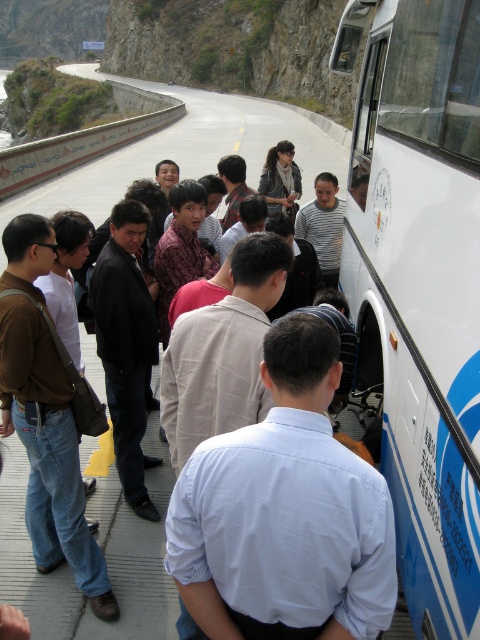
From the picture: Based on the scene description, where is the white matte bus at right located in terms of its 2D coordinates?

The white matte bus at right is located at the 2D coordinates of point (420, 285).

You are a pedestrian standing at the edge of the road where the dark gray leather jacket at center is located. You want to cross the road to reach the white matte bus at right. The road is 8 meters wide. Is there enough space between you and the bus to safely cross without needing to move either object?

The distance between the white matte bus at right and the dark gray leather jacket at center is 7.40 meters. Since the road is 8 meters wide, there is enough space to cross safely without moving either object.

You are a photographer trying to capture a group photo of the people near the white matte bus at right and the dark gray leather jacket at center. Since you want to include both subjects in the frame, which object should you focus on first to ensure both are visible?

The white matte bus at right is bigger than the dark gray leather jacket at center, so you should focus on the white matte bus at right first to ensure both are visible in the frame.